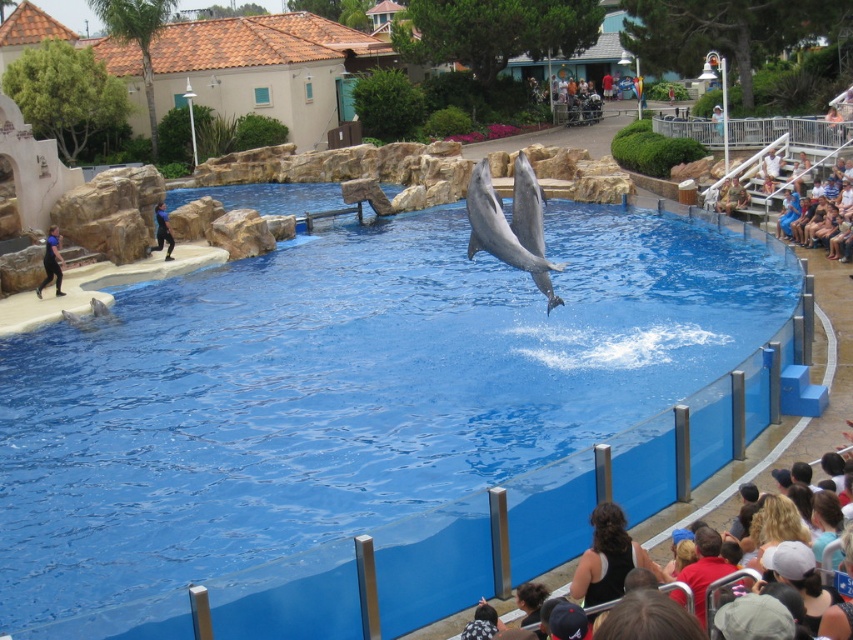
Question: Which object is closer to the camera taking this photo?

Choices:
 (A) blue smooth water at center
 (B) blue fabric shirt at left
 (C) brown hair at lower right
 (D) black rubber wetsuit at lower left

Answer: (A)

Question: Estimate the real-world distances between objects in this image. Which object is farther from the blue smooth water at center?

Choices:
 (A) brown hair at lower right
 (B) blue fabric shirt at left

Answer: (B)

Question: Is blue smooth water at center above black fabric at lower center?

Choices:
 (A) yes
 (B) no

Answer: (A)

Question: Is gray smooth dolphin at center further to the viewer compared to black fabric at lower center?

Choices:
 (A) no
 (B) yes

Answer: (B)

Question: Does blue smooth water at center appear under blue fabric shirt at left?

Choices:
 (A) no
 (B) yes

Answer: (B)

Question: Which object is the farthest from the gray smooth dolphin at center?

Choices:
 (A) brown hair at lower right
 (B) blue smooth water at center
 (C) blue fabric shirt at left

Answer: (C)